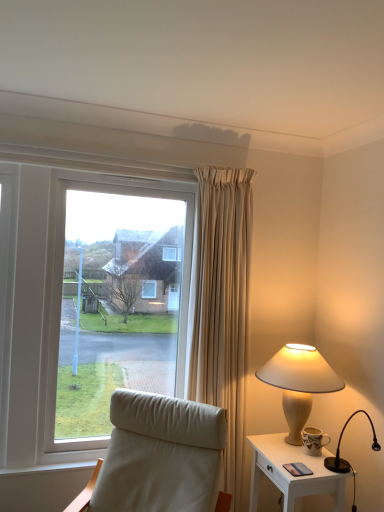
Question: Is white glossy nightstand at lower right aimed at black glossy lamp at right, placed as the 2th lamp when sorted from back to front?

Choices:
 (A) yes
 (B) no

Answer: (B)

Question: From a real-world perspective, is white glossy nightstand at lower right positioned under black glossy lamp at right, which is the first lamp in front-to-back order, based on gravity?

Choices:
 (A) yes
 (B) no

Answer: (A)

Question: Is white glossy nightstand at lower right turned away from black glossy lamp at right, which is the first lamp in front-to-back order?

Choices:
 (A) no
 (B) yes

Answer: (A)

Question: From the image's perspective, would you say white glossy nightstand at lower right is positioned over black glossy lamp at right, which is the first lamp in front-to-back order?

Choices:
 (A) yes
 (B) no

Answer: (B)

Question: Can you confirm if white glossy nightstand at lower right is smaller than black glossy lamp at right, placed as the 2th lamp when sorted from back to front?

Choices:
 (A) yes
 (B) no

Answer: (B)

Question: In terms of width, does black glossy lamp at right, placed as the 2th lamp when sorted from back to front, look wider or thinner when compared to matte beige lamp at right, marked as the 1th lamp in a back-to-front arrangement?

Choices:
 (A) thin
 (B) wide

Answer: (A)

Question: From a real-world perspective, is black glossy lamp at right, which is the first lamp in front-to-back order, above or below matte beige lamp at right, which ranks as the 2th lamp in front-to-back order?

Choices:
 (A) above
 (B) below

Answer: (B)

Question: Based on their positions, is black glossy lamp at right, placed as the 2th lamp when sorted from back to front, located to the left or right of matte beige lamp at right, which ranks as the 2th lamp in front-to-back order?

Choices:
 (A) left
 (B) right

Answer: (B)

Question: Would you say black glossy lamp at right, which is the first lamp in front-to-back order, is inside or outside matte beige lamp at right, which ranks as the 2th lamp in front-to-back order?

Choices:
 (A) inside
 (B) outside

Answer: (B)

Question: Considering their positions, is matte beige lamp at right, marked as the 1th lamp in a back-to-front arrangement, located in front of or behind white glossy nightstand at lower right?

Choices:
 (A) front
 (B) behind

Answer: (B)

Question: From the image's perspective, is matte beige lamp at right, marked as the 1th lamp in a back-to-front arrangement, located above or below white glossy nightstand at lower right?

Choices:
 (A) below
 (B) above

Answer: (B)

Question: Does point (289, 356) appear closer or farther from the camera than point (304, 461)?

Choices:
 (A) closer
 (B) farther

Answer: (B)

Question: Considering the positions of matte beige lamp at right, which ranks as the 2th lamp in front-to-back order, and white glossy nightstand at lower right in the image, is matte beige lamp at right, which ranks as the 2th lamp in front-to-back order, taller or shorter than white glossy nightstand at lower right?

Choices:
 (A) tall
 (B) short

Answer: (A)

Question: Choose the correct answer: Is black glossy lamp at right, which is the first lamp in front-to-back order, inside white glossy nightstand at lower right or outside it?

Choices:
 (A) outside
 (B) inside

Answer: (A)

Question: Is point (329, 458) closer or farther from the camera than point (276, 467)?

Choices:
 (A) closer
 (B) farther

Answer: (B)